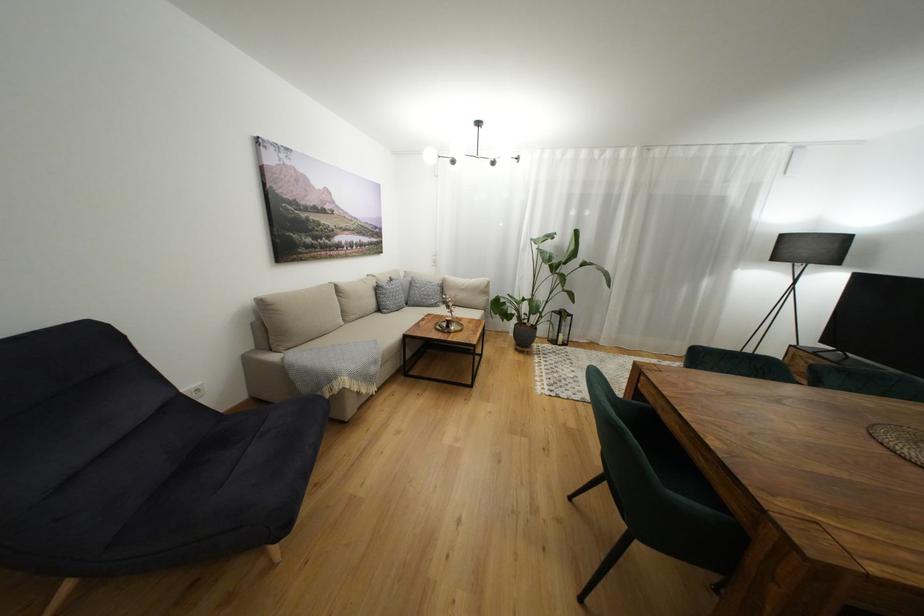
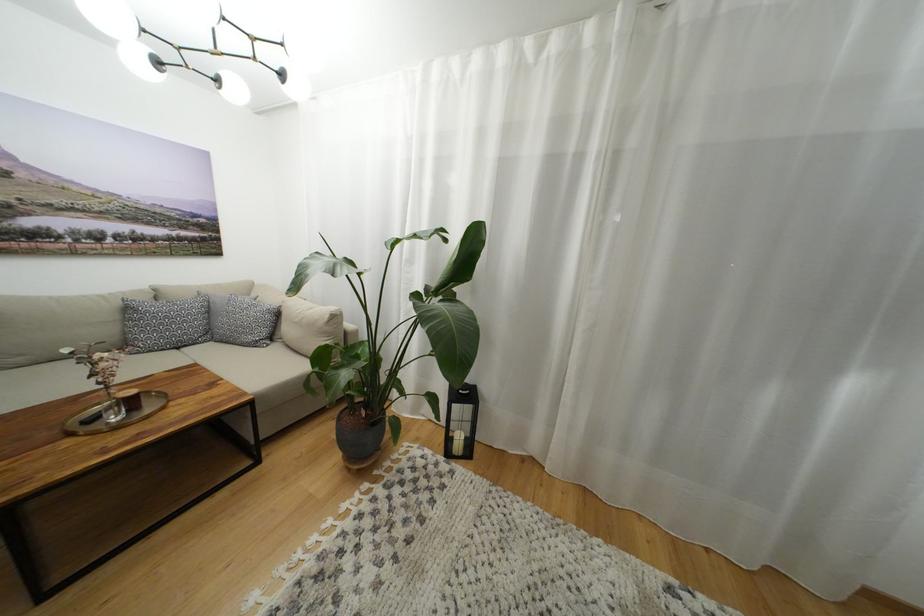
What movement of the cameraman would produce the second image?

The cameraman walked toward right, forward.